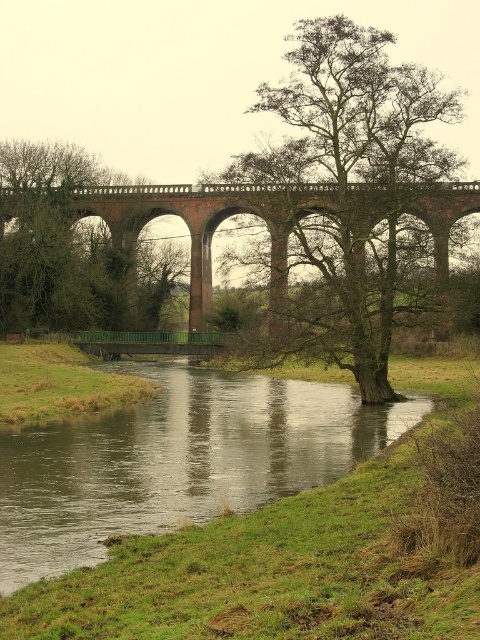
Who is positioned more to the right, green leafy tree at center or green leafy tree at left?

green leafy tree at center is more to the right.

Does green leafy tree at center have a smaller size compared to green leafy tree at left?

Incorrect, green leafy tree at center is not smaller in size than green leafy tree at left.

Does point (332, 48) come behind point (26, 220)?

That is False.

Locate an element on the screen. Image resolution: width=480 pixels, height=640 pixels. green leafy tree at center is located at coordinates (354, 192).

Based on the photo, is green grassy river at center to the right of green leafy tree at center from the viewer's perspective?

Incorrect, green grassy river at center is not on the right side of green leafy tree at center.

Who is more distant from viewer, (223, 381) or (358, 44)?

The point (223, 381) is behind.

The width and height of the screenshot is (480, 640). Identify the location of green grassy river at center. (177, 460).

Is the position of green grassy river at center less distant than that of brick arch bridge at center?

Yes, it is.

Does green grassy river at center have a lesser width compared to brick arch bridge at center?

Correct, green grassy river at center's width is less than brick arch bridge at center's.

What do you see at coordinates (177, 460) in the screenshot?
I see `green grassy river at center` at bounding box center [177, 460].

Where is `green grassy river at center`? green grassy river at center is located at coordinates (177, 460).